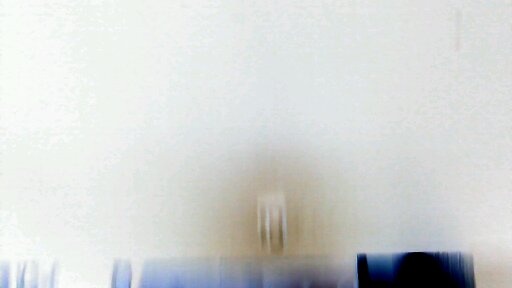
In order to click on white wall in this screenshot , I will do point(203,87).